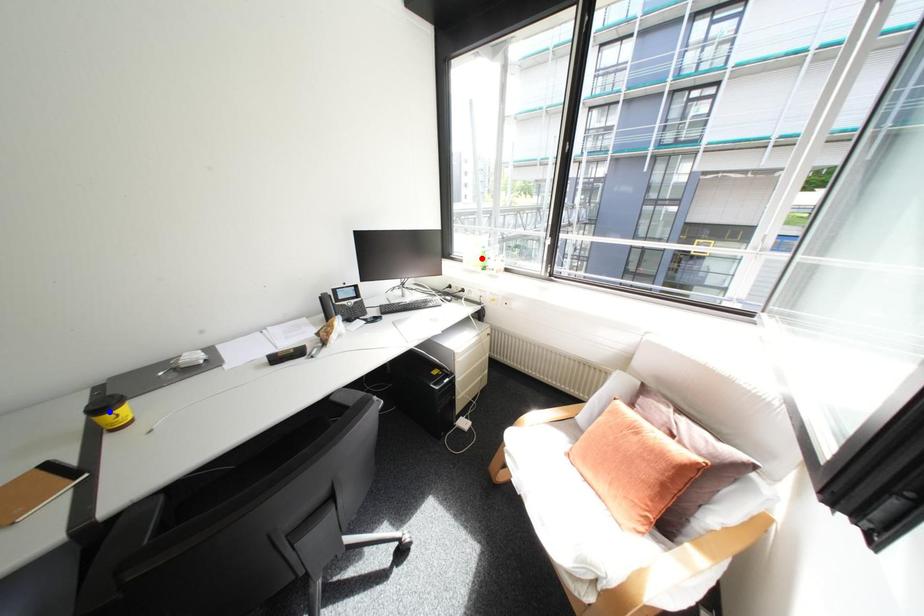
Question: Which of the two points in the image is closer to the camera?

Choices:
 (A) Blue point is closer.
 (B) Red point is closer.

Answer: (A)